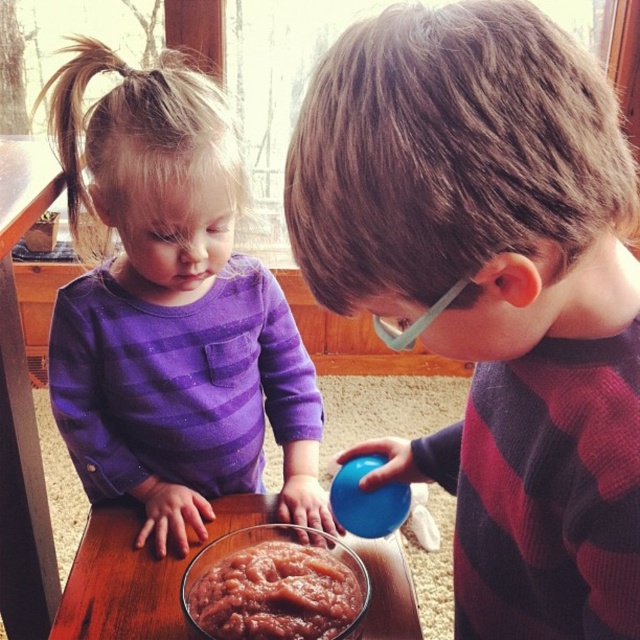
Who is more distant from viewer, (380, 540) or (246, 541)?

Point (380, 540)

How distant is transparent glass bowl at center from smooth brownish paste at center?

transparent glass bowl at center is 4.48 inches from smooth brownish paste at center.

This screenshot has height=640, width=640. I want to click on transparent glass bowl at center, so click(120, 584).

Find the location of a particular element. transparent glass bowl at center is located at coordinates 120,584.

Does purple soft fabric at upper left have a larger size compared to smooth brownish paste at center?

Yes.

Which is in front, point (86, 129) or point (305, 556)?

Point (305, 556)

Where is `purple soft fabric at upper left`? purple soft fabric at upper left is located at coordinates (172, 310).

Between blue rubber ball at center and clear plastic goggles at right, which one has more height?

blue rubber ball at center is taller.

Between blue rubber ball at center and clear plastic goggles at right, which one has less height?

Standing shorter between the two is clear plastic goggles at right.

Does point (372, 205) lie in front of point (404, 337)?

Yes, it is in front of point (404, 337).

This screenshot has width=640, height=640. Find the location of `blue rubber ball at center`. blue rubber ball at center is located at coordinates (492, 292).